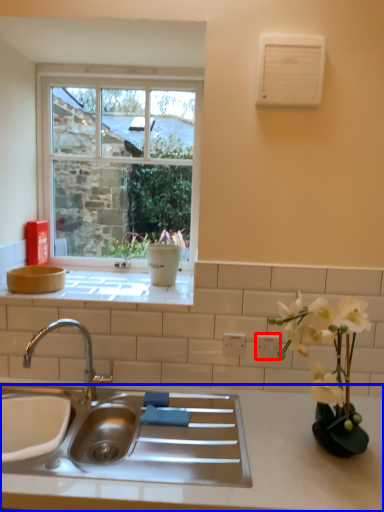
Question: Among these objects, which one is farthest to the camera, electric outlet (highlighted by a red box) or countertop (highlighted by a blue box)?

Choices:
 (A) electric outlet
 (B) countertop

Answer: (A)